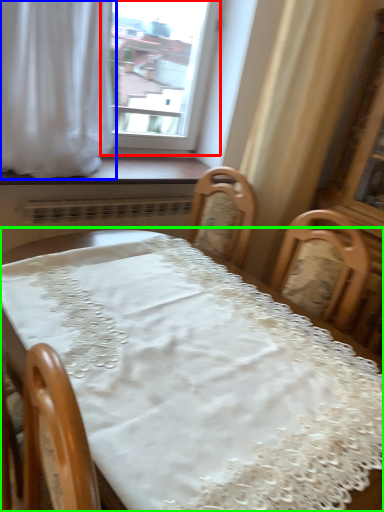
Question: Considering the real-world distances, which object is farthest from window (highlighted by a red box)? curtain (highlighted by a blue box) or table (highlighted by a green box)?

Choices:
 (A) curtain
 (B) table

Answer: (B)